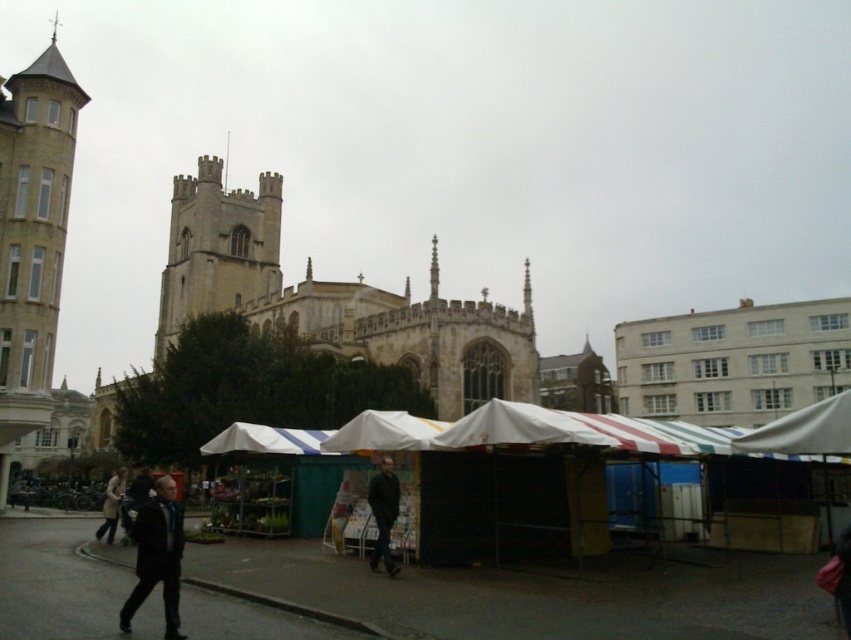
Question: Which of the following is the farthest from the observer?

Choices:
 (A) dark gray jacket at center
 (B) light brown leather coat at lower left
 (C) white fabric canopy at right
 (D) stone gothic cathedral at center

Answer: (D)

Question: Is light brown stone tower at left to the right of light brown leather coat at lower left from the viewer's perspective?

Choices:
 (A) no
 (B) yes

Answer: (A)

Question: Which object is farther from the camera taking this photo?

Choices:
 (A) white fabric canopy at right
 (B) light brown stone tower at left
 (C) dark gray suit at lower left
 (D) dark gray jacket at center

Answer: (B)

Question: Which object is farther from the camera taking this photo?

Choices:
 (A) light brown leather coat at lower left
 (B) white fabric canopy at right

Answer: (A)

Question: Can you confirm if light brown stone tower at left is positioned to the right of light brown leather coat at lower left?

Choices:
 (A) no
 (B) yes

Answer: (A)

Question: Can you confirm if stone gothic cathedral at center is wider than light brown stone tower at left?

Choices:
 (A) yes
 (B) no

Answer: (A)